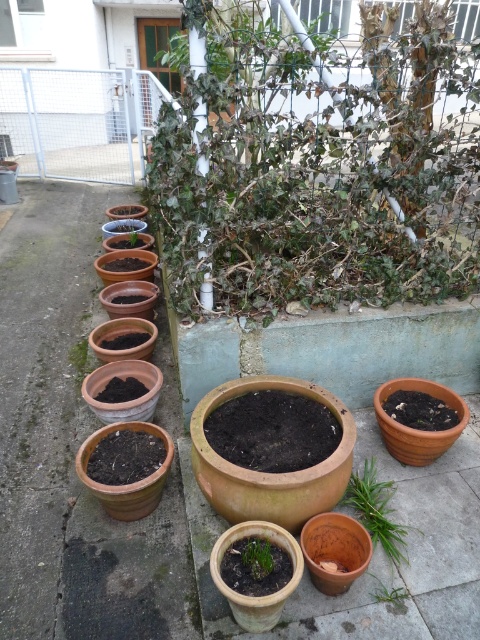
Question: Among these points, which one is farthest from the camera?

Choices:
 (A) (372, 467)
 (B) (269, 547)

Answer: (A)

Question: Which point is closer to the camera taking this photo?

Choices:
 (A) (349, 506)
 (B) (402, 588)
 (C) (326, 51)

Answer: (B)

Question: Which point is closer to the camera?

Choices:
 (A) green leafy plant at center
 (B) green leafy plant at lower center
 (C) green leafy plant at lower right

Answer: (B)

Question: Is green leafy plant at center below terracotta clay pots at center?

Choices:
 (A) no
 (B) yes

Answer: (A)

Question: Does green leafy plant at center have a greater width compared to green leafy plant at lower right?

Choices:
 (A) yes
 (B) no

Answer: (A)

Question: Considering the relative positions of green leafy plant at center and green matte plant at center in the image provided, where is green leafy plant at center located with respect to green matte plant at center?

Choices:
 (A) left
 (B) right

Answer: (B)